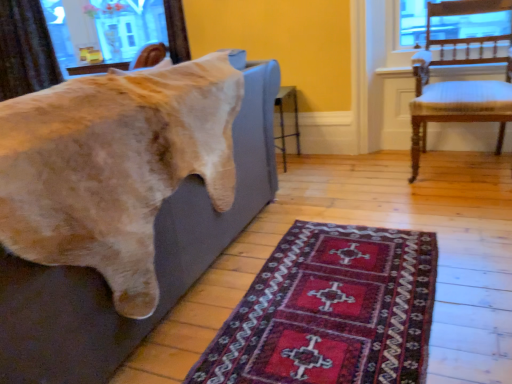
Identify the location of vacant space underneath dark red woven rug at lower center (from a real-world perspective). The image size is (512, 384). (348, 299).